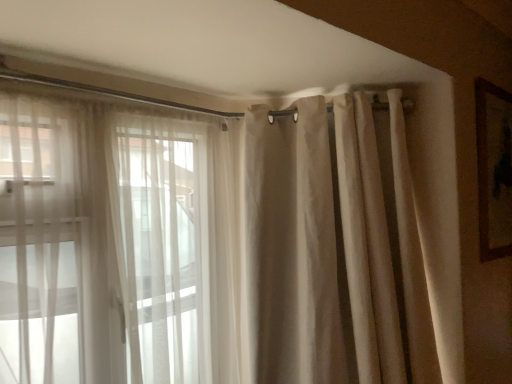
Question: Is the depth of beige fabric curtain at upper right less than that of sheer white curtains at left?

Choices:
 (A) no
 (B) yes

Answer: (A)

Question: Does beige fabric curtain at upper right have a larger size compared to sheer white curtains at left?

Choices:
 (A) yes
 (B) no

Answer: (A)

Question: From a real-world perspective, is beige fabric curtain at upper right beneath sheer white curtains at left?

Choices:
 (A) no
 (B) yes

Answer: (A)

Question: Is beige fabric curtain at upper right taller than sheer white curtains at left?

Choices:
 (A) no
 (B) yes

Answer: (B)

Question: Does beige fabric curtain at upper right have a smaller size compared to sheer white curtains at left?

Choices:
 (A) yes
 (B) no

Answer: (B)

Question: Is beige fabric curtain at upper right at the right side of sheer white curtains at left?

Choices:
 (A) no
 (B) yes

Answer: (B)

Question: Does brown wooden picture frame at upper right have a greater width compared to beige fabric curtain at upper right?

Choices:
 (A) no
 (B) yes

Answer: (A)

Question: Does brown wooden picture frame at upper right have a smaller size compared to beige fabric curtain at upper right?

Choices:
 (A) yes
 (B) no

Answer: (A)

Question: Does brown wooden picture frame at upper right come in front of beige fabric curtain at upper right?

Choices:
 (A) no
 (B) yes

Answer: (A)

Question: Can you confirm if brown wooden picture frame at upper right is thinner than beige fabric curtain at upper right?

Choices:
 (A) no
 (B) yes

Answer: (B)

Question: Is brown wooden picture frame at upper right directly adjacent to beige fabric curtain at upper right?

Choices:
 (A) yes
 (B) no

Answer: (B)

Question: From the image's perspective, is brown wooden picture frame at upper right below beige fabric curtain at upper right?

Choices:
 (A) no
 (B) yes

Answer: (A)

Question: From a real-world perspective, is sheer white curtains at left positioned under brown wooden picture frame at upper right based on gravity?

Choices:
 (A) no
 (B) yes

Answer: (B)